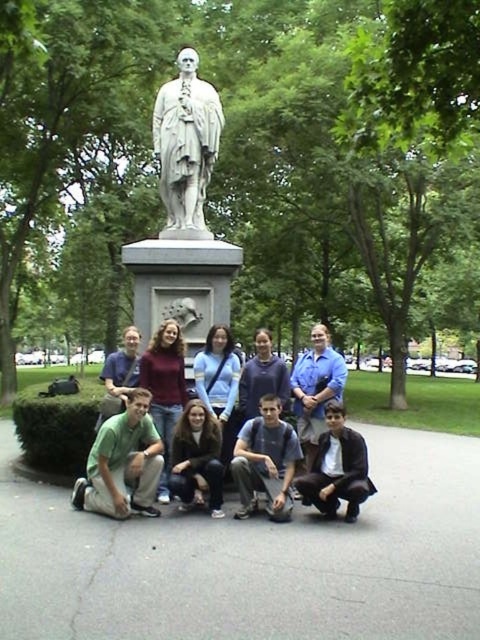
Does white marble statue at center appear on the right side of blue denim jeans at center?

In fact, white marble statue at center is to the left of blue denim jeans at center.

Which of these two, white marble statue at center or blue denim jeans at center, stands shorter?

Standing shorter between the two is blue denim jeans at center.

Image resolution: width=480 pixels, height=640 pixels. What do you see at coordinates (186, 147) in the screenshot? I see `white marble statue at center` at bounding box center [186, 147].

This screenshot has width=480, height=640. Identify the location of white marble statue at center. (186, 147).

Which is more to the left, matte blue shirt at center or dark brown hair at center?

dark brown hair at center

Who is higher up, matte blue shirt at center or dark brown hair at center?

matte blue shirt at center

The height and width of the screenshot is (640, 480). I want to click on matte blue shirt at center, so click(265, 461).

Locate an element on the screen. This screenshot has height=640, width=480. matte blue shirt at center is located at coordinates (265, 461).

Can you confirm if matte blue shirt at center is positioned above white marble statue at center?

Actually, matte blue shirt at center is below white marble statue at center.

Looking at this image, which of these two, matte blue shirt at center or white marble statue at center, stands taller?

Standing taller between the two is white marble statue at center.

Does point (267, 477) come in front of point (195, 170)?

Yes, it is.

Where is `matte blue shirt at center`? The width and height of the screenshot is (480, 640). matte blue shirt at center is located at coordinates (265, 461).